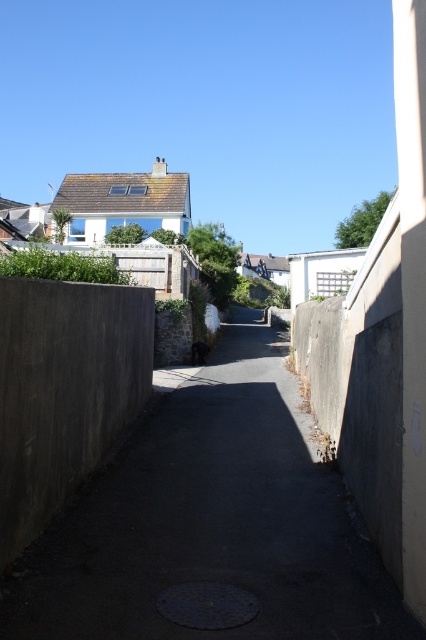
You are standing in the alleyway and want to move from point (218,474) to point (17,371). Which direction should you face to move towards the closer point?

Point (17,371) is closer to the viewer than point (218,474). To move towards the closer point, you should face away from the viewer, which would be towards the direction of point (17,371).

You are a delivery robot with a width of 1.2 meters. You need to navigate through the narrow alley depicted in the scene. Can you safely pass between the dark concrete path at center and the concrete wall at left without touching either side?

The dark concrete path at center is 3.36 meters from the concrete wall at left. Since the robot is only 1.2 meters wide, there is sufficient space between the two objects to allow safe passage without touching either side.